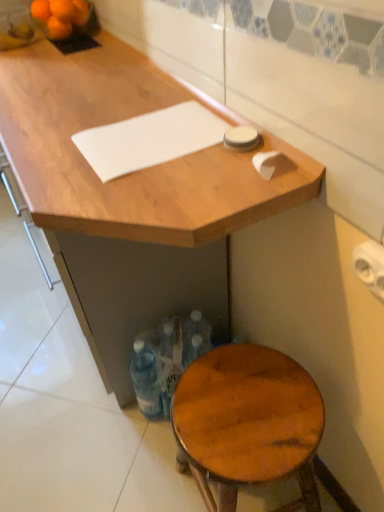
Where is `free spot above wooden stool at lower right (from a real-world perspective)`? free spot above wooden stool at lower right (from a real-world perspective) is located at coordinates (243, 408).